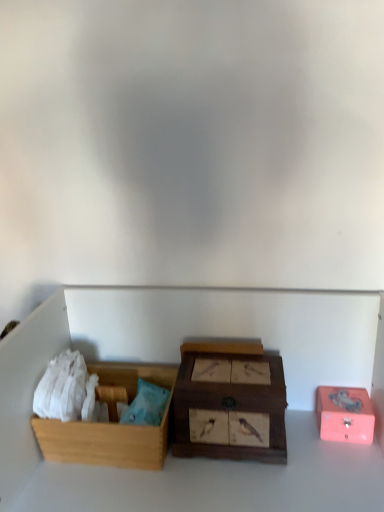
In order to click on pink matte box at right, which is the 1th box in right-to-left order in this screenshot , I will do `click(345, 414)`.

Find the location of `wooden box with bird pictures at center, which appears as the 2th box when viewed from the left`. wooden box with bird pictures at center, which appears as the 2th box when viewed from the left is located at coordinates (230, 403).

Locate an element on the screen. Image resolution: width=384 pixels, height=512 pixels. wooden box at left, positioned as the first box in left-to-right order is located at coordinates (111, 423).

Is wooden box with bird pictures at center, which appears as the 2th box when viewed from the left, located within wooden box at left, positioned as the first box in left-to-right order?

Actually, wooden box with bird pictures at center, which appears as the 2th box when viewed from the left, is outside wooden box at left, positioned as the first box in left-to-right order.

Measure the distance between wooden box at left, positioned as the first box in left-to-right order, and wooden box with bird pictures at center, positioned as the 2th box in right-to-left order.

They are 6.68 inches apart.

From a real-world perspective, is wooden box at left, positioned as the first box in left-to-right order, beneath wooden box with bird pictures at center, positioned as the 2th box in right-to-left order?

Yes, from a real-world perspective, wooden box at left, positioned as the first box in left-to-right order, is beneath wooden box with bird pictures at center, positioned as the 2th box in right-to-left order.

Considering the relative positions of wooden box at left, placed as the 3th box when sorted from right to left, and wooden box with bird pictures at center, positioned as the 2th box in right-to-left order, in the image provided, is wooden box at left, placed as the 3th box when sorted from right to left, to the left of wooden box with bird pictures at center, positioned as the 2th box in right-to-left order, from the viewer's perspective?

Yes, wooden box at left, placed as the 3th box when sorted from right to left, is to the left of wooden box with bird pictures at center, positioned as the 2th box in right-to-left order.

In the scene shown: Does pink matte box at right, which is the 1th box in right-to-left order, have a larger size compared to wooden box at left, placed as the 3th box when sorted from right to left?

No.

Is pink matte box at right, which is the 1th box in right-to-left order, behind wooden box at left, positioned as the first box in left-to-right order?

Yes, it is.

Is pink matte box at right, which is the 1th box in right-to-left order, at the left side of wooden box at left, positioned as the first box in left-to-right order?

No.

How different are the orientations of wooden box with bird pictures at center, which appears as the 2th box when viewed from the left, and pink matte box at right, which is the 1th box in right-to-left order, in degrees?

The angle between the facing direction of wooden box with bird pictures at center, which appears as the 2th box when viewed from the left, and the facing direction of pink matte box at right, which is the 1th box in right-to-left order, is 1.6 degrees.

Looking at this image, from the image's perspective, between wooden box with bird pictures at center, which appears as the 2th box when viewed from the left, and pink matte box at right, which is the 1th box in right-to-left order, who is located below?

pink matte box at right, which is the 1th box in right-to-left order, appears lower in the image.

Between wooden box with bird pictures at center, positioned as the 2th box in right-to-left order, and pink matte box at right, arranged as the 3th box when viewed from the left, which one appears on the left side from the viewer's perspective?

From the viewer's perspective, wooden box with bird pictures at center, positioned as the 2th box in right-to-left order, appears more on the left side.

Is wooden box with bird pictures at center, positioned as the 2th box in right-to-left order, oriented towards pink matte box at right, arranged as the 3th box when viewed from the left?

A: No, wooden box with bird pictures at center, positioned as the 2th box in right-to-left order, is not facing towards pink matte box at right, arranged as the 3th box when viewed from the left.

Can you tell me how much wooden box with bird pictures at center, which appears as the 2th box when viewed from the left, and wooden box at left, placed as the 3th box when sorted from right to left, differ in facing direction?

They differ by 1.59 degrees in their facing directions.

From the image's perspective, does wooden box with bird pictures at center, which appears as the 2th box when viewed from the left, appear lower than wooden box at left, positioned as the first box in left-to-right order?

No, from the image's perspective, wooden box with bird pictures at center, which appears as the 2th box when viewed from the left, is not below wooden box at left, positioned as the first box in left-to-right order.

Between wooden box with bird pictures at center, which appears as the 2th box when viewed from the left, and wooden box at left, placed as the 3th box when sorted from right to left, which one has smaller width?

wooden box with bird pictures at center, which appears as the 2th box when viewed from the left.

Does point (272, 397) come farther from viewer compared to point (100, 457)?

No.

From the image's perspective, which is below, pink matte box at right, arranged as the 3th box when viewed from the left, or wooden box with bird pictures at center, which appears as the 2th box when viewed from the left?

pink matte box at right, arranged as the 3th box when viewed from the left, from the image's perspective.

Is pink matte box at right, which is the 1th box in right-to-left order, facing away from wooden box with bird pictures at center, which appears as the 2th box when viewed from the left?

No, pink matte box at right, which is the 1th box in right-to-left order, is not facing away from wooden box with bird pictures at center, which appears as the 2th box when viewed from the left.

Can you tell me how much pink matte box at right, which is the 1th box in right-to-left order, and wooden box with bird pictures at center, which appears as the 2th box when viewed from the left, differ in facing direction?

They differ by 1.6 degrees in their facing directions.

Is pink matte box at right, which is the 1th box in right-to-left order, beside wooden box with bird pictures at center, positioned as the 2th box in right-to-left order?

No.

Does wooden box at left, placed as the 3th box when sorted from right to left, have a greater width compared to pink matte box at right, which is the 1th box in right-to-left order?

Correct, the width of wooden box at left, placed as the 3th box when sorted from right to left, exceeds that of pink matte box at right, which is the 1th box in right-to-left order.

From a real-world perspective, who is located higher, wooden box at left, placed as the 3th box when sorted from right to left, or pink matte box at right, which is the 1th box in right-to-left order?

wooden box at left, placed as the 3th box when sorted from right to left, is physically above.

Considering the sizes of wooden box at left, placed as the 3th box when sorted from right to left, and pink matte box at right, arranged as the 3th box when viewed from the left, in the image, is wooden box at left, placed as the 3th box when sorted from right to left, taller or shorter than pink matte box at right, arranged as the 3th box when viewed from the left,?

wooden box at left, placed as the 3th box when sorted from right to left, is taller than pink matte box at right, arranged as the 3th box when viewed from the left.

Does point (145, 368) come in front of point (358, 402)?

No.

Starting from the wooden box at left, placed as the 3th box when sorted from right to left, which box is the 1st one to the right? Please provide its 2D coordinates.

[(230, 403)]

Where is `the 1st box above when counting from the pink matte box at right, arranged as the 3th box when viewed from the left (from the image's perspective)`? the 1st box above when counting from the pink matte box at right, arranged as the 3th box when viewed from the left (from the image's perspective) is located at coordinates (111, 423).

Estimate the real-world distances between objects in this image. Which object is further from pink matte box at right, arranged as the 3th box when viewed from the left, wooden box at left, placed as the 3th box when sorted from right to left, or wooden box with bird pictures at center, which appears as the 2th box when viewed from the left?

wooden box at left, placed as the 3th box when sorted from right to left.

Looking at the image, which one is located closer to wooden box with bird pictures at center, positioned as the 2th box in right-to-left order, wooden box at left, placed as the 3th box when sorted from right to left, or pink matte box at right, which is the 1th box in right-to-left order?

The object closer to wooden box with bird pictures at center, positioned as the 2th box in right-to-left order, is wooden box at left, placed as the 3th box when sorted from right to left.

Looking at the image, which one is located closer to wooden box with bird pictures at center, which appears as the 2th box when viewed from the left, pink matte box at right, which is the 1th box in right-to-left order, or wooden box at left, placed as the 3th box when sorted from right to left?

The object closer to wooden box with bird pictures at center, which appears as the 2th box when viewed from the left, is wooden box at left, placed as the 3th box when sorted from right to left.

Which object lies further to the anchor point wooden box at left, placed as the 3th box when sorted from right to left, wooden box with bird pictures at center, positioned as the 2th box in right-to-left order, or pink matte box at right, arranged as the 3th box when viewed from the left?

Based on the image, pink matte box at right, arranged as the 3th box when viewed from the left, appears to be further to wooden box at left, placed as the 3th box when sorted from right to left.

Based on their spatial positions, is wooden box with bird pictures at center, positioned as the 2th box in right-to-left order, or wooden box at left, placed as the 3th box when sorted from right to left, closer to pink matte box at right, which is the 1th box in right-to-left order?

Among the two, wooden box with bird pictures at center, positioned as the 2th box in right-to-left order, is located nearer to pink matte box at right, which is the 1th box in right-to-left order.

Considering their positions, is pink matte box at right, arranged as the 3th box when viewed from the left, positioned further to wooden box at left, positioned as the first box in left-to-right order, than wooden box with bird pictures at center, positioned as the 2th box in right-to-left order?

pink matte box at right, arranged as the 3th box when viewed from the left, is further to wooden box at left, positioned as the first box in left-to-right order.

Where is `box between wooden box at left, placed as the 3th box when sorted from right to left, and pink matte box at right, which is the 1th box in right-to-left order, from left to right`? box between wooden box at left, placed as the 3th box when sorted from right to left, and pink matte box at right, which is the 1th box in right-to-left order, from left to right is located at coordinates (230, 403).